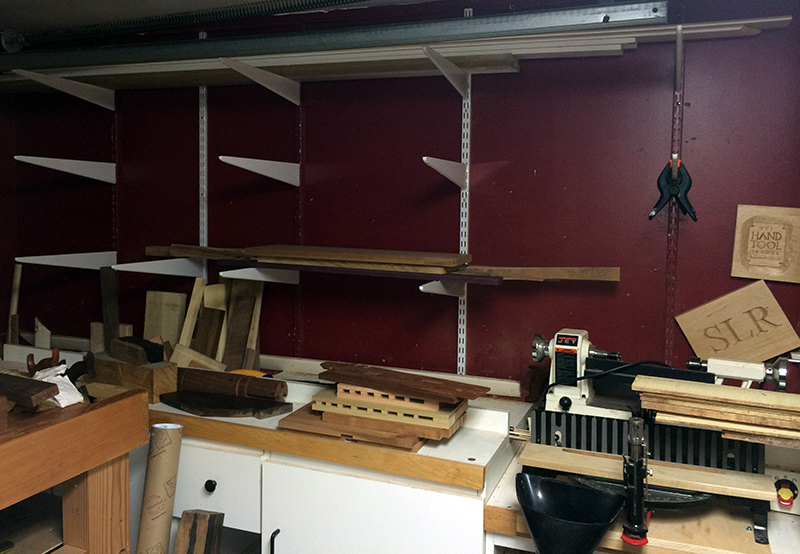
The width and height of the screenshot is (800, 554). I want to click on ceiling, so click(65, 11).